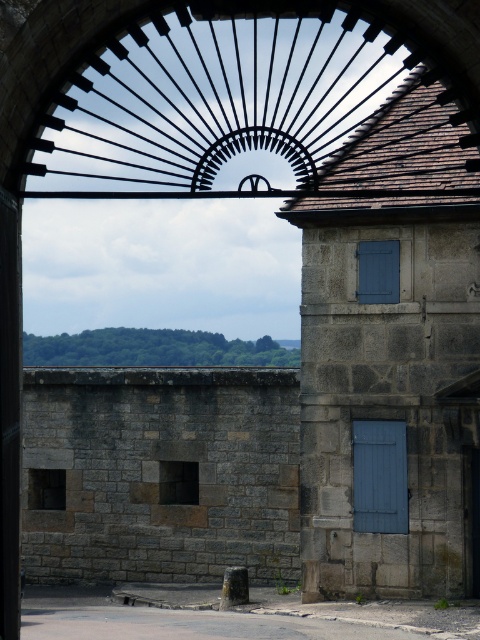
You are standing in front of the stone building and want to enter through the wooden door at right. The black iron gate at upper center is blocking your path. Can you walk around it to reach the door?

The black iron gate at upper center is 26.87 meters away from the wooden door at right. Since the gate is positioned above the door, you can walk around it to reach the door as they are separated by a significant distance.

You are standing in front of the stone building and notice two points marked on the wall. The first point is at coordinate (156, 154) and the second at (479, 508). From your perspective, which point is closer to you?

Point (479, 508) is closer to you because point (156, 154) is behind it.